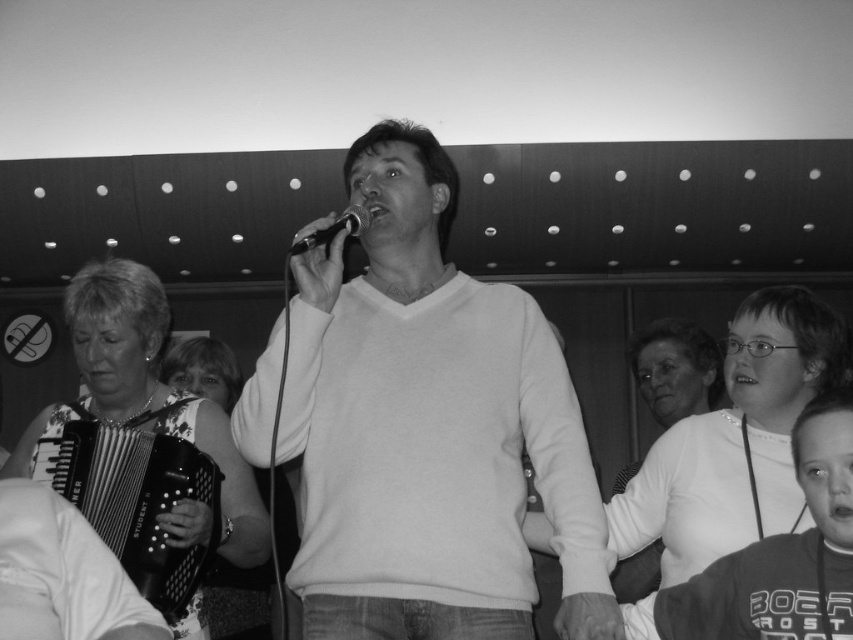
Question: Does metallic black accordion at lower left come in front of black metallic microphone at center?

Choices:
 (A) no
 (B) yes

Answer: (A)

Question: Estimate the real-world distances between objects in this image. Which object is farther from the black metallic microphone at center?

Choices:
 (A) metallic black accordion at lower left
 (B) smooth white sweater at center

Answer: (A)

Question: Observing the image, what is the correct spatial positioning of smooth white sweater at center in reference to metallic black accordion at lower left?

Choices:
 (A) right
 (B) left

Answer: (A)

Question: Among these points, which one is nearest to the camera?

Choices:
 (A) (364, 212)
 (B) (146, 445)
 (C) (531, 605)

Answer: (A)

Question: Which point is closer to the camera taking this photo?

Choices:
 (A) (345, 305)
 (B) (341, 221)
 (C) (165, 426)

Answer: (B)

Question: Is smooth white sweater at center positioned before black metallic microphone at center?

Choices:
 (A) yes
 (B) no

Answer: (B)